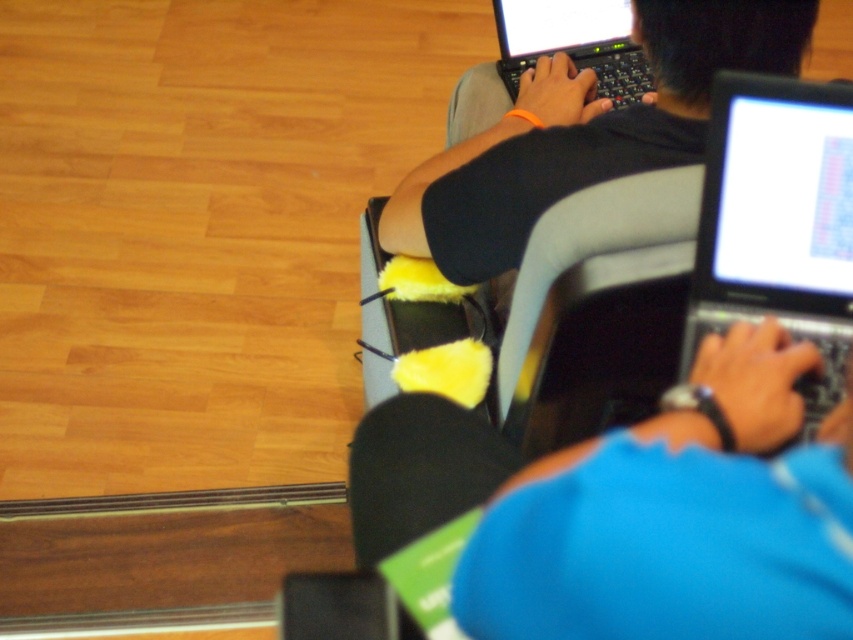
Does matte black laptop at upper center appear on the left side of gray fabric armchair at center?

No, matte black laptop at upper center is not to the left of gray fabric armchair at center.

Who is positioned more to the right, matte black laptop at upper center or gray fabric armchair at center?

From the viewer's perspective, matte black laptop at upper center appears more on the right side.

Identify the location of matte black laptop at upper center. (584, 132).

From the picture: Which is below, matte black laptop at upper center or black glossy laptop at right?

black glossy laptop at right is lower down.

From the picture: Is matte black laptop at upper center taller than black glossy laptop at right?

Indeed, matte black laptop at upper center has a greater height compared to black glossy laptop at right.

Does point (393, 248) come closer to viewer compared to point (810, 125)?

No, it is behind (810, 125).

Where is `matte black laptop at upper center`? matte black laptop at upper center is located at coordinates (584, 132).

Between gray fabric armchair at center and black plastic laptop at upper center, which one has more height?

gray fabric armchair at center is taller.

Can you confirm if gray fabric armchair at center is positioned to the left of black plastic laptop at upper center?

Correct, you'll find gray fabric armchair at center to the left of black plastic laptop at upper center.

Identify the location of gray fabric armchair at center. click(596, 305).

Locate an element on the screen. The height and width of the screenshot is (640, 853). gray fabric armchair at center is located at coordinates (596, 305).